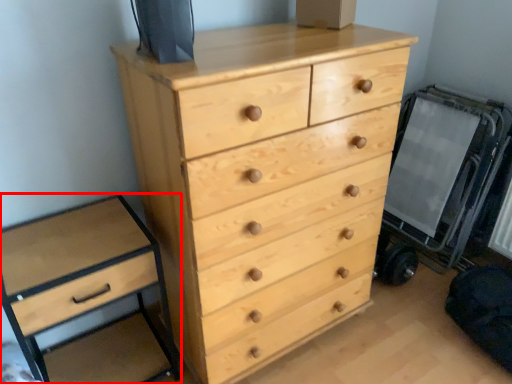
Question: From the image, what is the correct spatial relationship of chest of drawers (annotated by the red box) in relation to chest of drawers?

Choices:
 (A) left
 (B) right

Answer: (A)